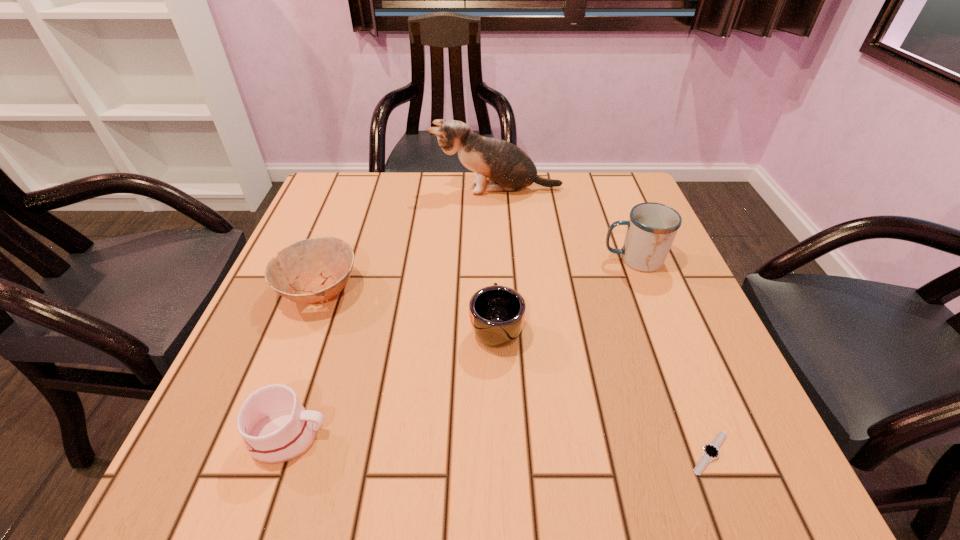
Locate an element on the screen. Image resolution: width=960 pixels, height=540 pixels. object situated at the far edge is located at coordinates (509, 168).

Where is `mug present at the near edge`? Image resolution: width=960 pixels, height=540 pixels. mug present at the near edge is located at coordinates (276, 428).

You are a GUI agent. You are given a task and a screenshot of the screen. Output one action in this format:
    pyautogui.click(x=<x>, y=<y>)
    Task: Click on the watch positioned at the near edge
    
    Given the screenshot: What is the action you would take?
    pyautogui.click(x=710, y=452)

The image size is (960, 540). I want to click on bowl at the left edge, so click(x=323, y=265).

You are a GUI agent. You are given a task and a screenshot of the screen. Output one action in this format:
    pyautogui.click(x=<x>, y=<y>)
    Task: Click on the mug located at the left edge
    This screenshot has height=540, width=960.
    Given the screenshot: What is the action you would take?
    pyautogui.click(x=276, y=428)

The height and width of the screenshot is (540, 960). Identify the location of mug that is positioned at the right edge. (652, 227).

I want to click on watch present at the right edge, so click(x=710, y=452).

I want to click on object that is at the near left corner, so click(276, 428).

Where is `object positioned at the near right corner`? object positioned at the near right corner is located at coordinates (710, 452).

This screenshot has width=960, height=540. I want to click on free space at the far edge, so click(x=425, y=177).